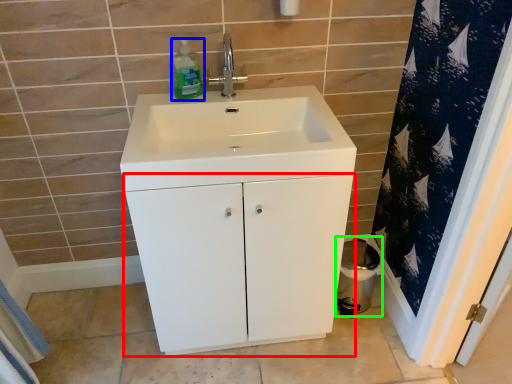
Question: Based on their relative distances, which object is nearer to bathroom cabinet (highlighted by a red box)? Choose from cleaning product (highlighted by a blue box) and toilet bowl (highlighted by a green box).

Choices:
 (A) cleaning product
 (B) toilet bowl

Answer: (B)